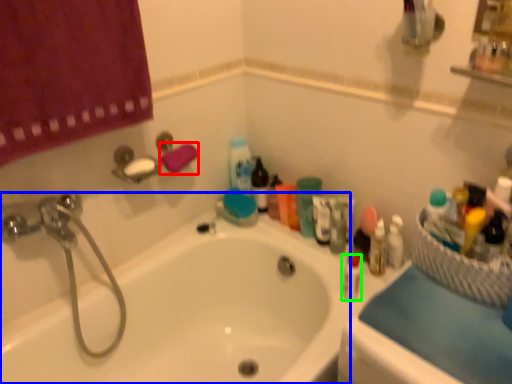
Question: Based on their relative distances, which object is farther from bath towel (highlighted by a red box)? Choose from bathtub (highlighted by a blue box) and mouthwash (highlighted by a green box).

Choices:
 (A) bathtub
 (B) mouthwash

Answer: (B)